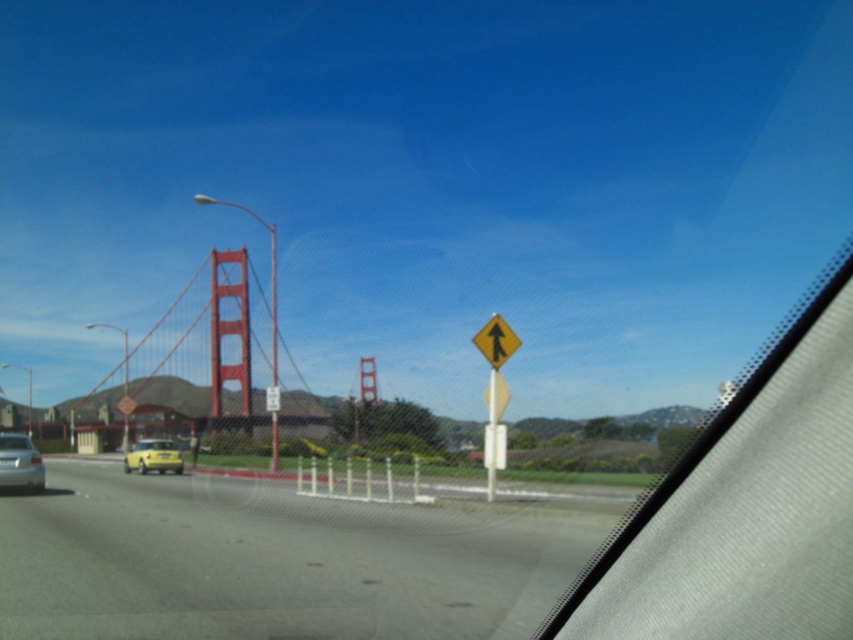
Looking at this image, is yellow matte diamond at center to the right of yellow matte car at center from the viewer's perspective?

Correct, you'll find yellow matte diamond at center to the right of yellow matte car at center.

Which is more to the right, yellow matte diamond at center or yellow matte car at center?

yellow matte diamond at center is more to the right.

In order to click on yellow matte diamond at center in this screenshot , I will do `click(494, 380)`.

In order to click on yellow matte diamond at center in this screenshot , I will do `click(494, 380)`.

Is yellow matte diamond at center thinner than silver metallic car at lower left?

Indeed, yellow matte diamond at center has a lesser width compared to silver metallic car at lower left.

Can you confirm if yellow matte diamond at center is positioned below silver metallic car at lower left?

Incorrect, yellow matte diamond at center is not positioned below silver metallic car at lower left.

Is point (518, 339) farther from viewer compared to point (12, 461)?

No, it is in front of (12, 461).

Where is `yellow matte diamond at center`? yellow matte diamond at center is located at coordinates (494, 380).

Is yellow matte car at center smaller than yellow matte traffic sign at center?

Incorrect, yellow matte car at center is not smaller in size than yellow matte traffic sign at center.

Does yellow matte car at center lie behind yellow matte traffic sign at center?

Yes, yellow matte car at center is behind yellow matte traffic sign at center.

Does point (125, 456) lie in front of point (480, 339)?

No, it is not.

Locate an element on the screen. Image resolution: width=853 pixels, height=640 pixels. yellow matte car at center is located at coordinates (154, 456).